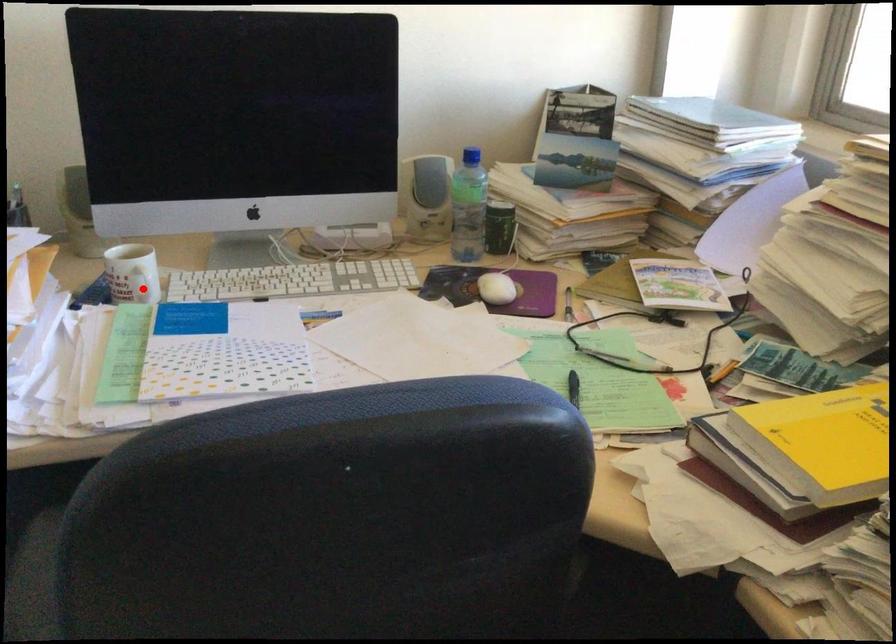
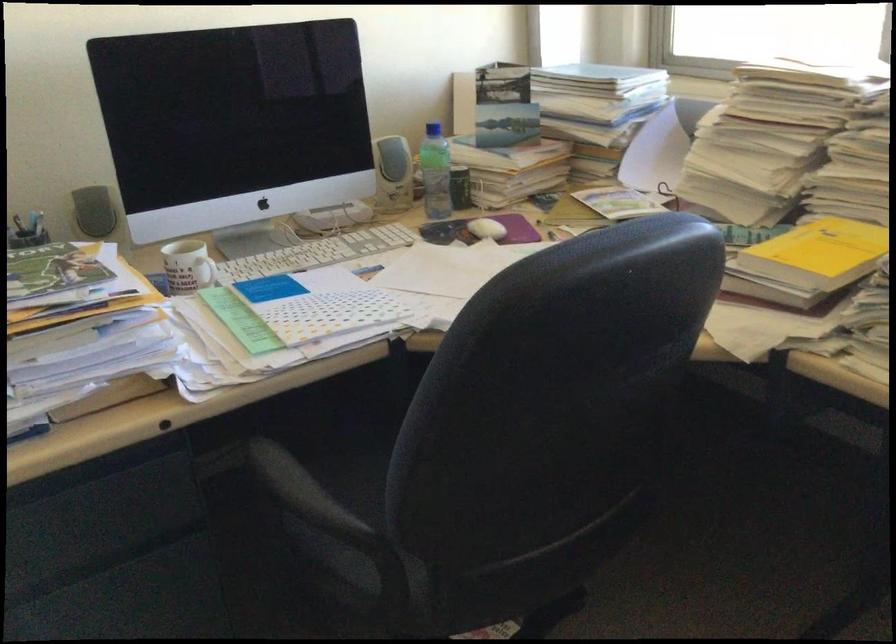
Question: I am providing you with two images of the same scene from different viewpoints. In image1, a red point is highlighted. Considering the same 3D point in image2, which of the following is correct?

Choices:
 (A) It is closer
 (B) It is farther

Answer: (B)